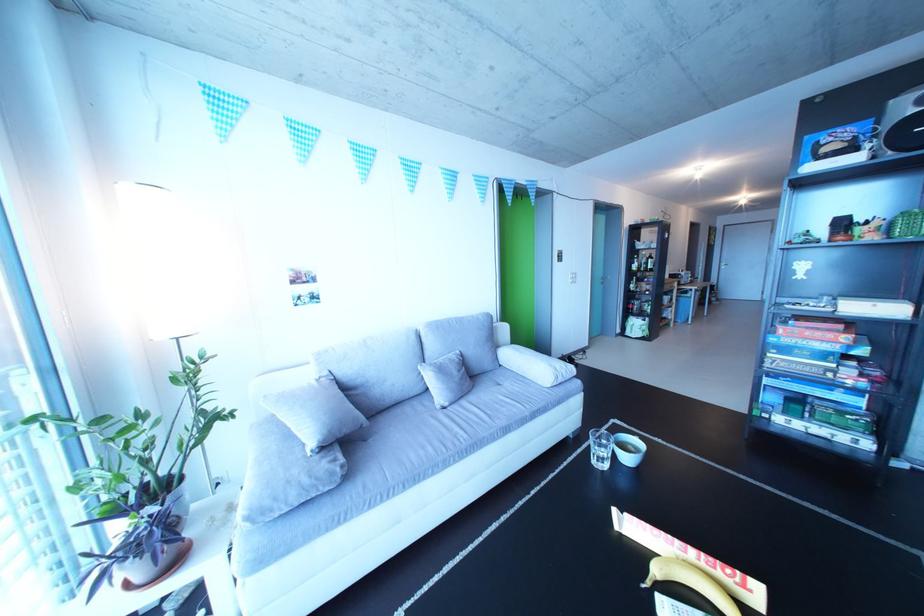
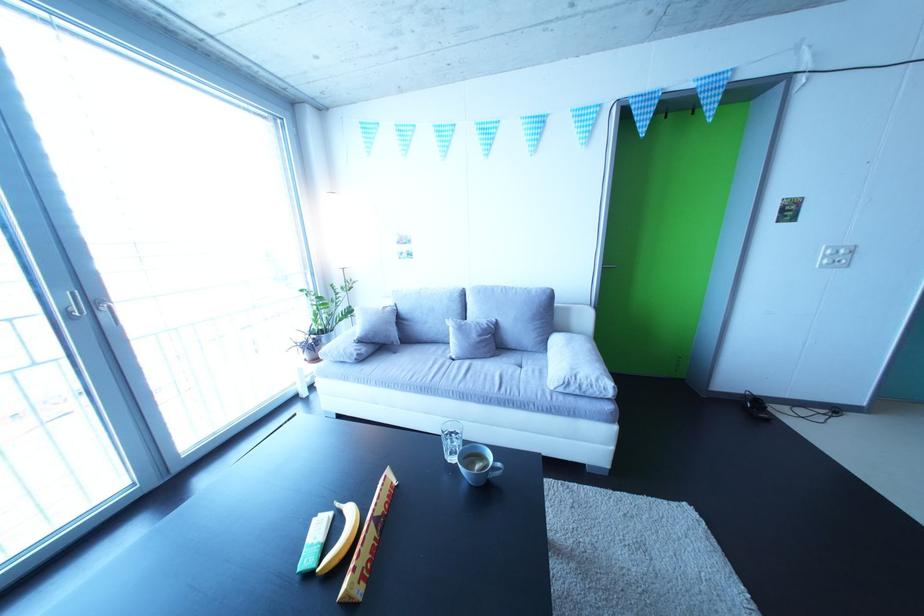
Locate, in the second image, the point that corresponds to point (630, 533) in the first image.

(395, 487)